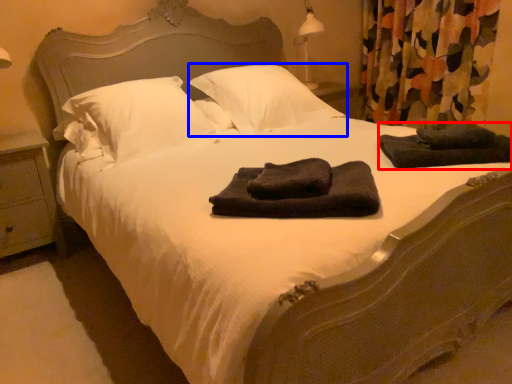
Question: Which point is closer to the camera, material (highlighted by a red box) or pillow (highlighted by a blue box)?

Choices:
 (A) material
 (B) pillow

Answer: (A)